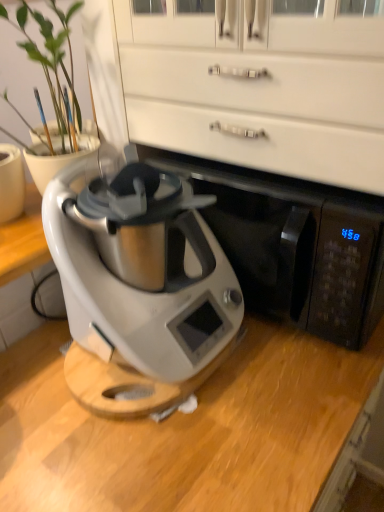
Question: In terms of width, does satin silver appliance at center look wider or thinner when compared to white glossy dresser at upper center?

Choices:
 (A) thin
 (B) wide

Answer: (B)

Question: Considering their positions, is satin silver appliance at center located in front of or behind white glossy dresser at upper center?

Choices:
 (A) front
 (B) behind

Answer: (B)

Question: Estimate the real-world distances between objects in this image. Which object is farther from the white glossy dresser at upper center?

Choices:
 (A) matte white vase at left
 (B) satin silver appliance at center
 (C) satin silver appliance at center

Answer: (A)

Question: Which is nearer to the satin silver appliance at center?

Choices:
 (A) satin silver appliance at center
 (B) matte white vase at left
 (C) white glossy dresser at upper center

Answer: (A)